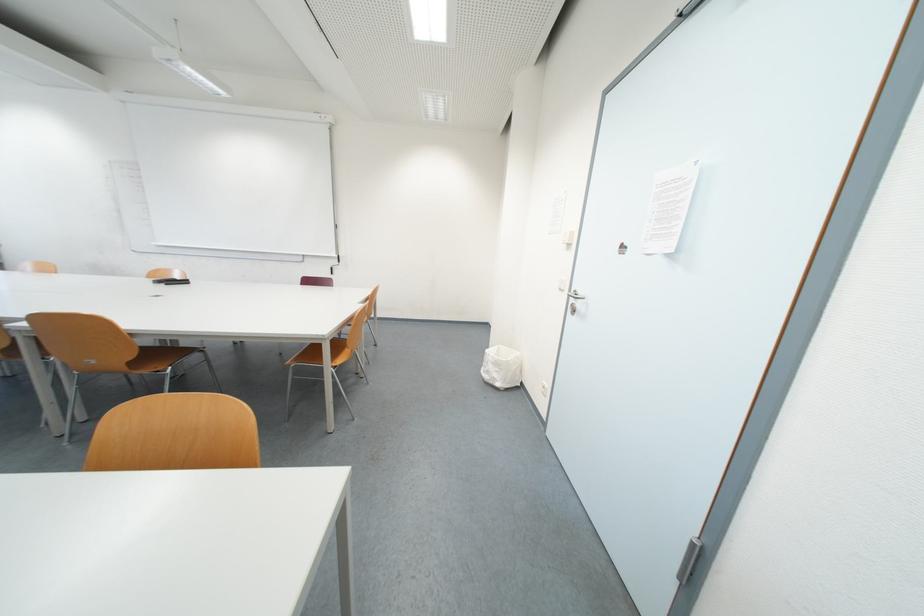
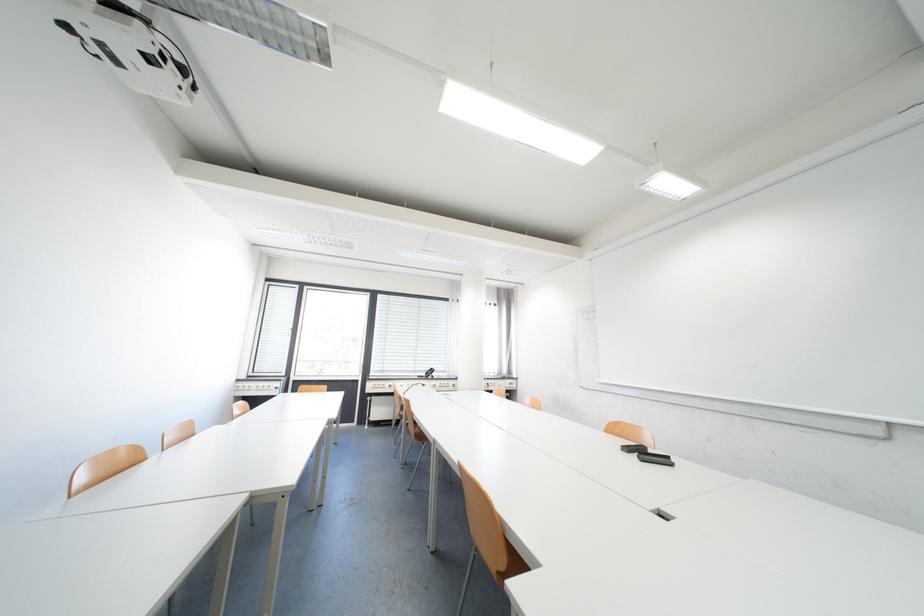
Where in the second image is the point corresponding to point 180,283 from the first image?

(652, 454)